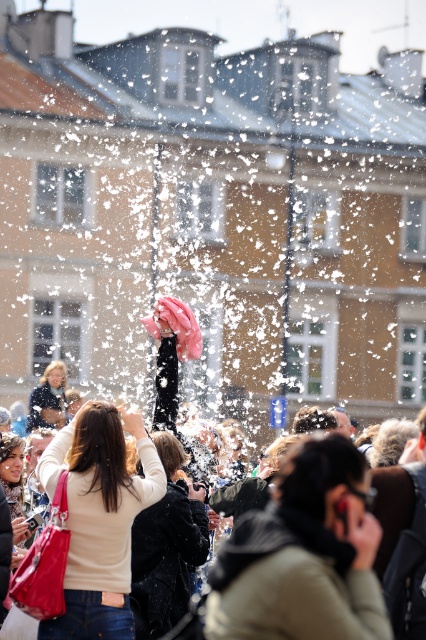
Which is behind, point (135, 516) or point (60, 413)?

The point (60, 413) is more distant.

Does point (138, 550) come farther from viewer compared to point (42, 380)?

That is False.

Find the location of a particular element. velvet black coat at center is located at coordinates (166, 547).

Who is lower down, light brown leather jacket at center or velvet black coat at center?

Positioned lower is velvet black coat at center.

Which is behind, point (313, 554) or point (138, 614)?

Positioned behind is point (138, 614).

Describe the element at coordinates (302, 556) in the screenshot. I see `light brown leather jacket at center` at that location.

The image size is (426, 640). Identify the location of light brown leather jacket at center. (302, 556).

Who is positioned more to the left, matte beige sweater at center or velvet black coat at center?

matte beige sweater at center

Measure the distance between point (114, 429) and camera.

217.99 feet

Where is `matte beige sweater at center`? Image resolution: width=426 pixels, height=640 pixels. matte beige sweater at center is located at coordinates (98, 516).